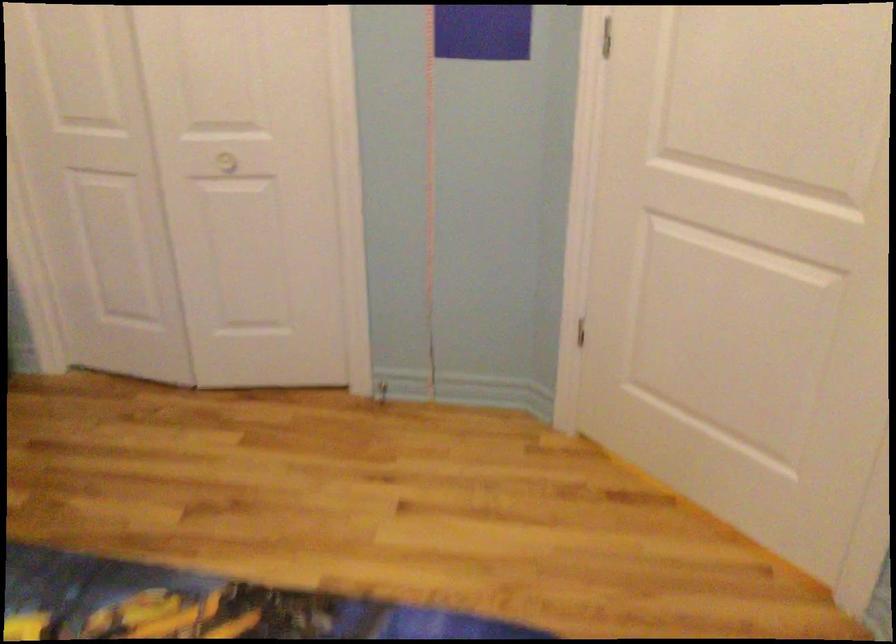
The width and height of the screenshot is (896, 644). What do you see at coordinates (227, 162) in the screenshot? I see `the white door knob` at bounding box center [227, 162].